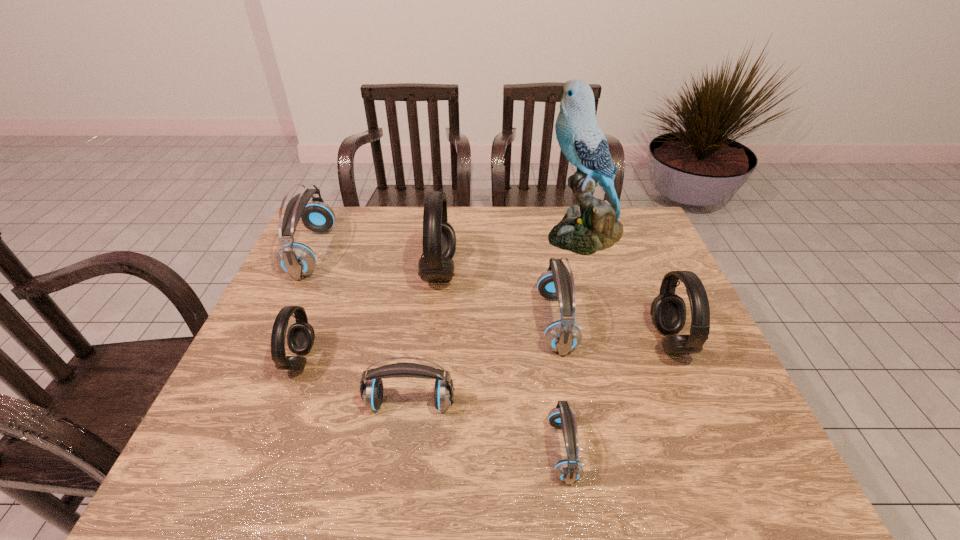
I want to click on vacant space that's between the third biggest blue headset and the rightmost headset, so click(540, 372).

Locate an element on the screen. The height and width of the screenshot is (540, 960). blank region between the tallest object and the second gray headset from right to left is located at coordinates [x=512, y=253].

You are a GUI agent. You are given a task and a screenshot of the screen. Output one action in this format:
    pyautogui.click(x=<x>, y=<y>)
    Task: Click on the third closest object to the farthest blue headset
    
    Given the screenshot: What is the action you would take?
    pyautogui.click(x=371, y=392)

Locate which object is the seventh closest to the second smallest blue headset. Please provide its 2D coordinates. Your answer should be formatted as a tuple, i.e. [(x, y)], where the tuple contains the x and y coordinates of a point satisfying the conditions above.

[(596, 227)]

Identify which headset is the sixth closest to the shortest headset. Please provide its 2D coordinates. Your answer should be formatted as a tuple, i.e. [(x, y)], where the tuple contains the x and y coordinates of a point satisfying the conditions above.

[(298, 260)]

The height and width of the screenshot is (540, 960). I want to click on headset identified as the second closest to the third blue headset from right to left, so click(x=569, y=470).

Select which gray headset appears as the second closest to the seventh object from right to left. Please provide its 2D coordinates. Your answer should be formatted as a tuple, i.e. [(x, y)], where the tuple contains the x and y coordinates of a point satisfying the conditions above.

[(668, 310)]

Locate which gray headset is the closest to the leftmost gray headset. Please provide its 2D coordinates. Your answer should be formatted as a tuple, i.e. [(x, y)], where the tuple contains the x and y coordinates of a point satisfying the conditions above.

[(439, 239)]

Locate which blue headset is the second closest to the shortest object. Please provide its 2D coordinates. Your answer should be formatted as a tuple, i.e. [(x, y)], where the tuple contains the x and y coordinates of a point satisfying the conditions above.

[(371, 392)]

Image resolution: width=960 pixels, height=540 pixels. I want to click on the third closest blue headset to the second gray headset from right to left, so click(298, 260).